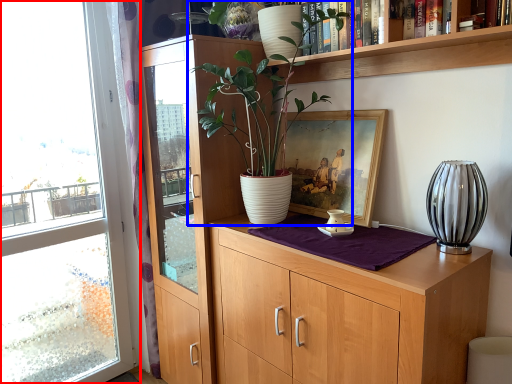
Question: Which of the following is the farthest to the observer, window (highlighted by a red box) or houseplant (highlighted by a blue box)?

Choices:
 (A) window
 (B) houseplant

Answer: (A)